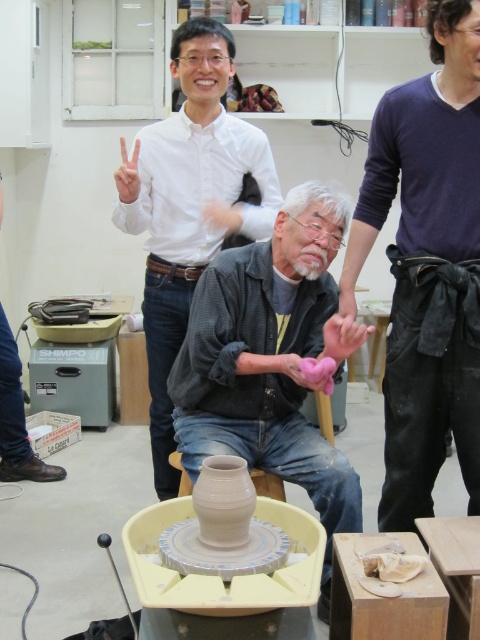
Based on the photo, does matte gray sweater at center have a larger size compared to white glossy shirt at upper center?

Incorrect, matte gray sweater at center is not larger than white glossy shirt at upper center.

Is matte gray sweater at center closer to camera compared to white glossy shirt at upper center?

Yes, matte gray sweater at center is closer to the viewer.

Does point (208, 321) come behind point (216, 49)?

That is False.

Locate an element on the screen. matte gray sweater at center is located at coordinates point(272,360).

Does dark blue sweater at center have a greater height compared to matte gray sweater at center?

Yes, dark blue sweater at center is taller than matte gray sweater at center.

Who is more forward, (x=458, y=61) or (x=314, y=387)?

Positioned in front is point (x=458, y=61).

Is point (394, 404) more distant than point (218, 378)?

No, it is not.

You are a GUI agent. You are given a task and a screenshot of the screen. Output one action in this format:
    pyautogui.click(x=<x>, y=<y>)
    Task: Click on the dark blue sweater at center
    The height and width of the screenshot is (640, 480).
    Given the screenshot: What is the action you would take?
    pyautogui.click(x=424, y=154)

How distant is dark blue sweater at center from white glossy shirt at upper center?

dark blue sweater at center is 72.43 centimeters from white glossy shirt at upper center.

The width and height of the screenshot is (480, 640). What are the coordinates of `dark blue sweater at center` in the screenshot? It's located at (424, 154).